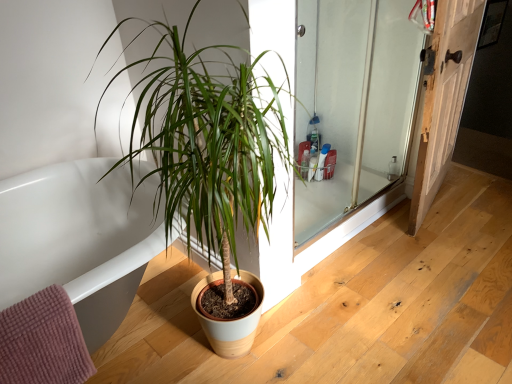
Question: From a real-world perspective, is white glossy bathtub at lower left physically located above or below wooden door at right?

Choices:
 (A) above
 (B) below

Answer: (B)

Question: Is white glossy bathtub at lower left taller or shorter than wooden door at right?

Choices:
 (A) tall
 (B) short

Answer: (B)

Question: Which is farther from the green matte plant at center?

Choices:
 (A) wooden door at right
 (B) white glossy bathtub at lower left
 (C) clear glass screen door at right

Answer: (A)

Question: Estimate the real-world distances between objects in this image. Which object is farther from the wooden door at right?

Choices:
 (A) white glossy bathtub at lower left
 (B) clear glass screen door at right
 (C) green matte plant at center

Answer: (A)